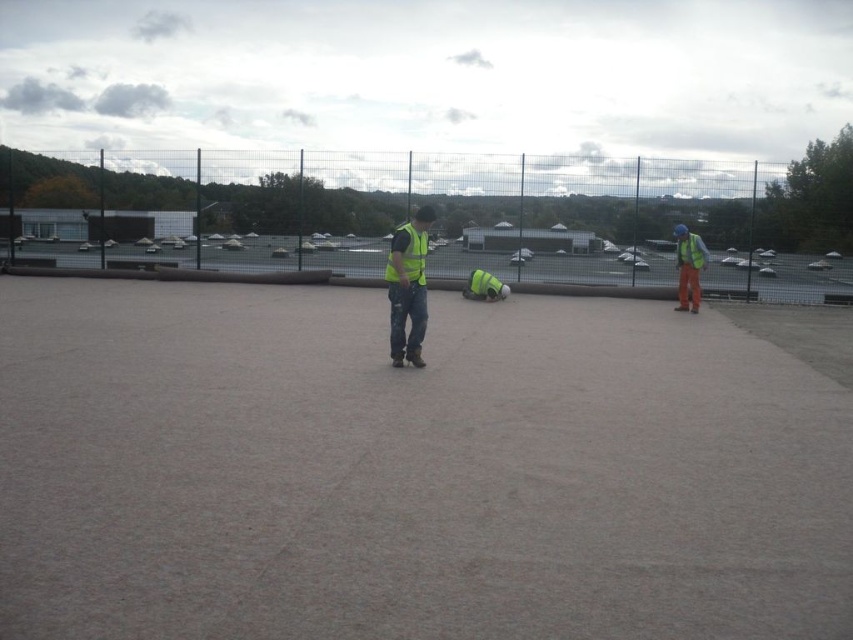
Is yellow reflective vest at center wider than hi-viz reflective jacket at right?

Incorrect, yellow reflective vest at center's width does not surpass hi-viz reflective jacket at right's.

Identify the location of yellow reflective vest at center. The height and width of the screenshot is (640, 853). (408, 288).

Between point (413, 282) and point (679, 228), which one is positioned in front?

Point (413, 282)

You are a GUI agent. You are given a task and a screenshot of the screen. Output one action in this format:
    pyautogui.click(x=<x>, y=<y>)
    Task: Click on the yellow reflective vest at center
    
    Given the screenshot: What is the action you would take?
    pyautogui.click(x=408, y=288)